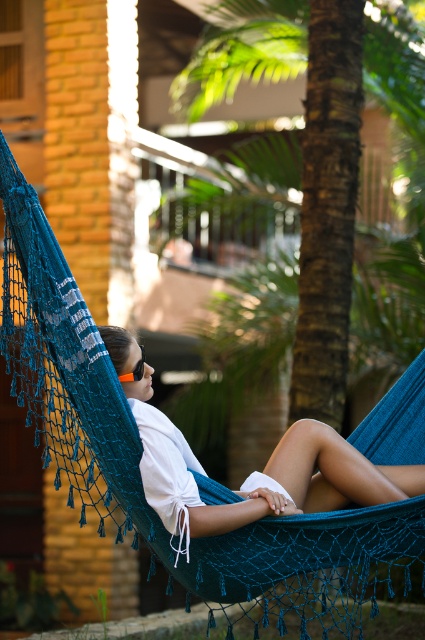
You are standing at the point marked by the coordinates point [317,144]. Looking around, you see the green textured palm tree at center. Which direction should you face to look towards the hammock?

The green textured palm tree at center is represented by point [317,144]. Since the hammock is part of the scene described in the scene, you should face away from the palm tree towards the hammock location.

You are a photographer planning to take a portrait of the person in the white cotton shirt at center. To avoid the green textured palm tree at center from blocking the subject, where should you position yourself relative to the person?

The green textured palm tree at center is positioned over the white cotton shirt at center. To avoid blocking the subject, position yourself so that you are not directly under or behind the palm tree, perhaps to the side or slightly behind the person to ensure the palm tree does not obscure the view.